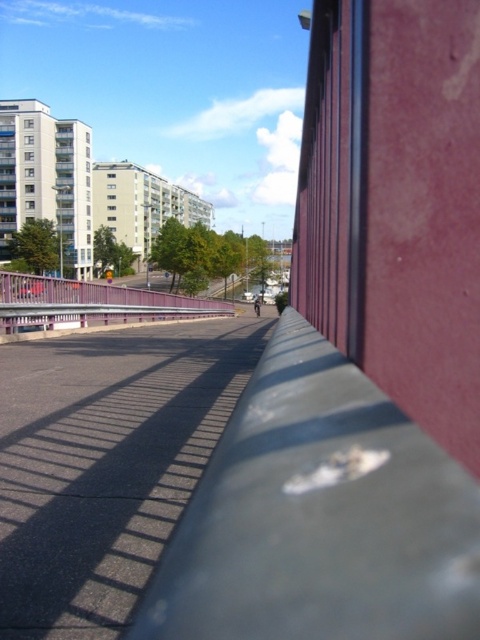
Is smooth gray concrete barrier at center bigger than pink metallic rail at center?

No.

Does smooth gray concrete barrier at center lie in front of pink metallic rail at center?

That is True.

Identify the location of smooth gray concrete barrier at center. (320, 516).